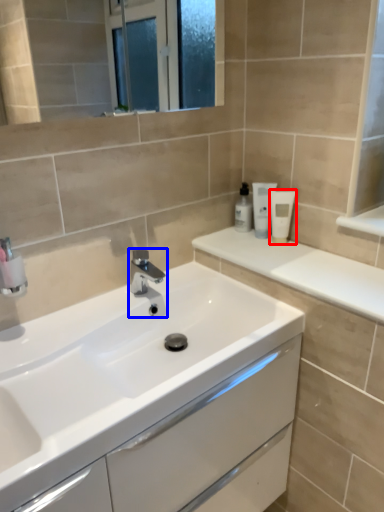
Question: Among these objects, which one is farthest to the camera, toiletry (highlighted by a red box) or tap (highlighted by a blue box)?

Choices:
 (A) toiletry
 (B) tap

Answer: (A)